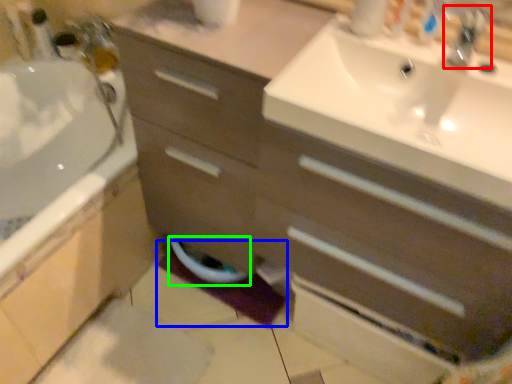
Question: Which is farther away from tap (highlighted by a red box)? bath mat (highlighted by a blue box) or toilet bowl (highlighted by a green box)?

Choices:
 (A) bath mat
 (B) toilet bowl

Answer: (A)